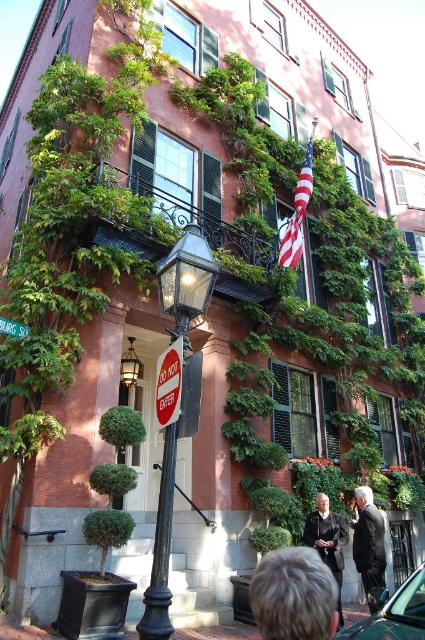
Question: Does dark suit at lower right appear on the left side of american flag at center?

Choices:
 (A) no
 (B) yes

Answer: (A)

Question: Is blonde hair at lower center below dark suit at lower right?

Choices:
 (A) no
 (B) yes

Answer: (A)

Question: Which of these objects is positioned closest to the green matte car at lower right?

Choices:
 (A) green plastic street sign at upper left
 (B) american flag at center

Answer: (A)

Question: Which point is farther to the camera?

Choices:
 (A) (6, 323)
 (B) (288, 620)

Answer: (A)

Question: Can you confirm if polished brass lamp post at center is positioned to the right of green plastic street sign at upper left?

Choices:
 (A) no
 (B) yes

Answer: (B)

Question: Which point is farther to the camera?

Choices:
 (A) polished brass lamp post at center
 (B) red matte sign at center

Answer: (A)